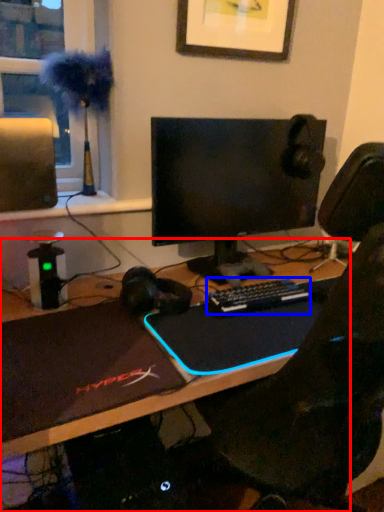
Question: Which object appears farthest to the camera in this image, desk (highlighted by a red box) or computer keyboard (highlighted by a blue box)?

Choices:
 (A) desk
 (B) computer keyboard

Answer: (B)